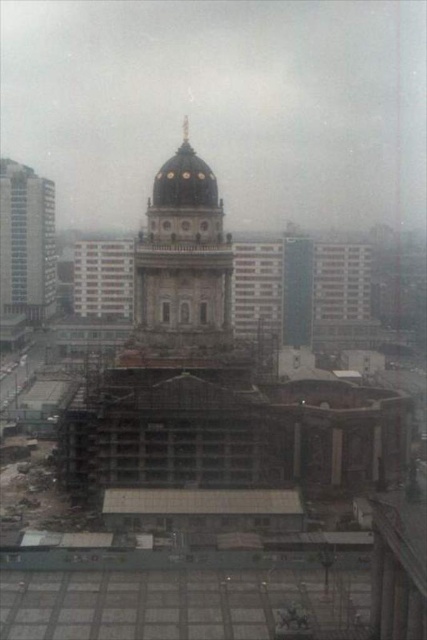
Does blue glass skyscraper at left appear under white glass windows at left?

Incorrect, blue glass skyscraper at left is not positioned below white glass windows at left.

Which of these two, blue glass skyscraper at left or white glass windows at left, stands taller?

blue glass skyscraper at left is taller.

Which is behind, point (25, 173) or point (117, 296)?

Point (25, 173)

Locate an element on the screen. Image resolution: width=427 pixels, height=640 pixels. blue glass skyscraper at left is located at coordinates (26, 243).

Which of these two, dark gray stone dome at center or blue glass skyscraper at left, stands taller?

blue glass skyscraper at left

Is dark gray stone dome at center bigger than blue glass skyscraper at left?

Yes, dark gray stone dome at center is bigger than blue glass skyscraper at left.

Who is more forward, (178, 305) or (32, 240)?

Point (178, 305) is in front.

At what (x,y) coordinates should I click in order to perform the action: click on dark gray stone dome at center. Please return your answer as a coordinate pair (x, y). This screenshot has height=640, width=427. Looking at the image, I should click on (183, 259).

Who is positioned more to the left, dark gray stone dome at center or white glass windows at left?

white glass windows at left is more to the left.

The height and width of the screenshot is (640, 427). What do you see at coordinates (183, 259) in the screenshot?
I see `dark gray stone dome at center` at bounding box center [183, 259].

Identify the location of dark gray stone dome at center. This screenshot has height=640, width=427. (183, 259).